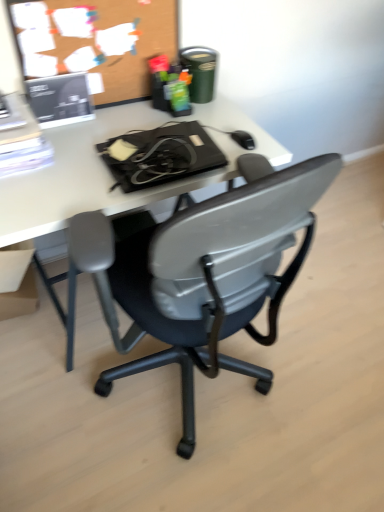
At what (x,y) coordinates should I click in order to perform the action: click on free space to the right of white plastic desk at center. Please return your answer as a coordinate pair (x, y). Image resolution: width=384 pixels, height=512 pixels. Looking at the image, I should click on (313, 354).